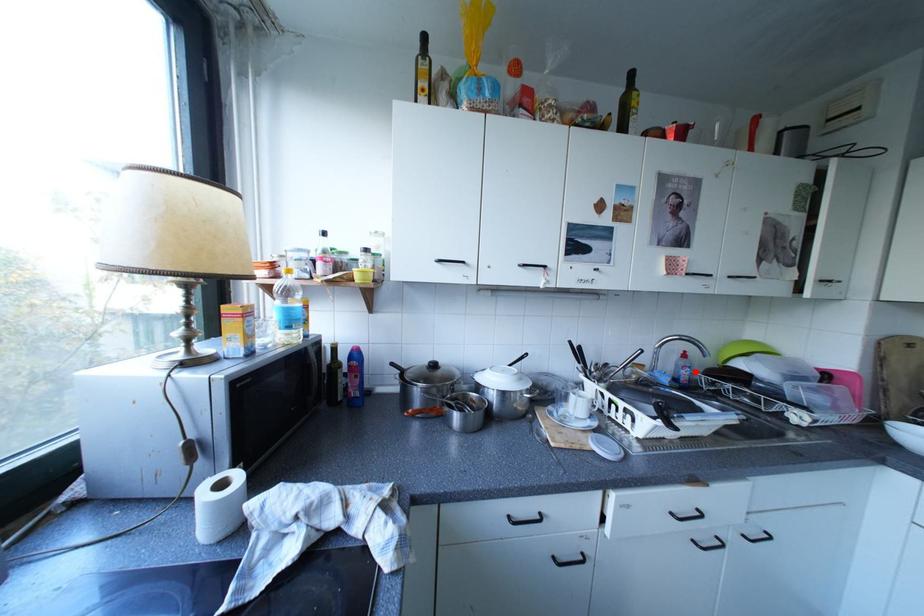
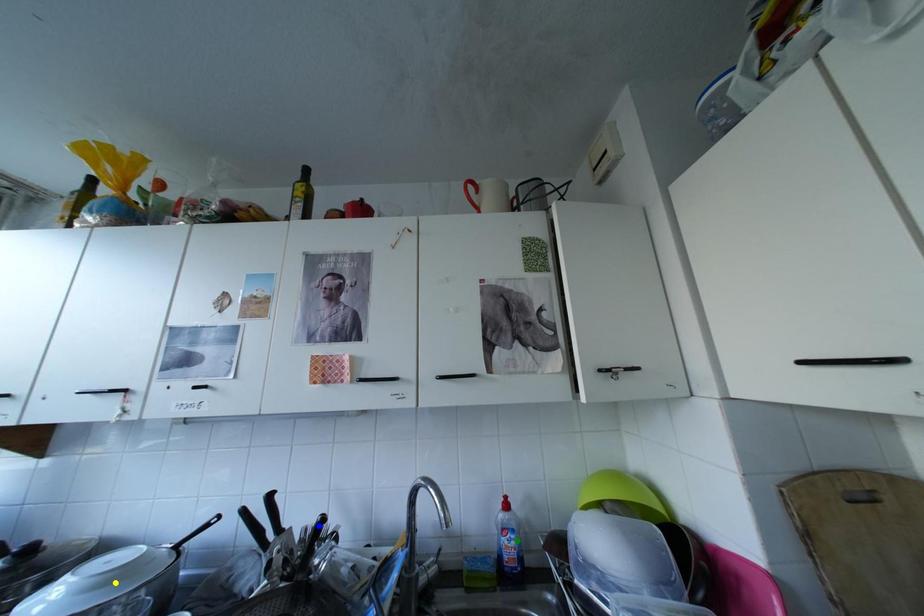
Question: I am providing you with two images of the same scene from different viewpoints. A red point is marked on the first image. You are given multiple points on the second image. Which point in image 2 represents the same 3d spot as the red point in image 1?

Choices:
 (A) blue point
 (B) green point
 (C) yellow point

Answer: (B)